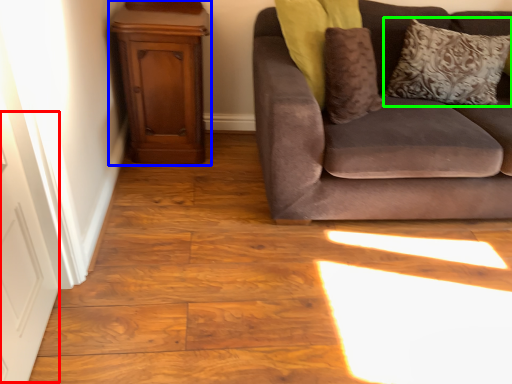
Question: Estimate the real-world distances between objects in this image. Which object is closer to door (highlighted by a red box), dresser (highlighted by a blue box) or pillow (highlighted by a green box)?

Choices:
 (A) dresser
 (B) pillow

Answer: (A)